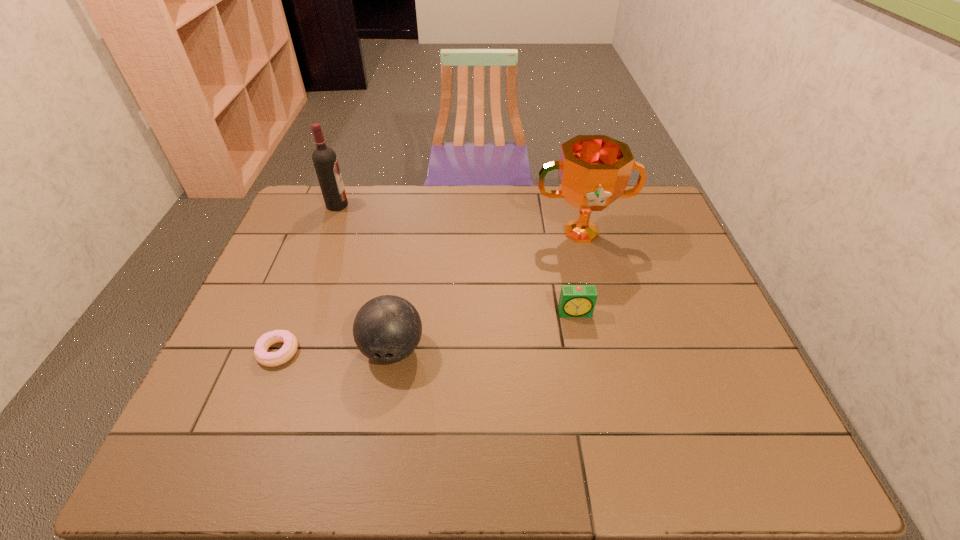
The height and width of the screenshot is (540, 960). Identify the location of vacant space at the near edge of the desktop. (658, 455).

Image resolution: width=960 pixels, height=540 pixels. In the image, there is a desktop. Find the location of `vacant space at the left edge`. vacant space at the left edge is located at coordinates (274, 391).

This screenshot has width=960, height=540. In the image, there is a desktop. Find the location of `vacant area at the right edge`. vacant area at the right edge is located at coordinates (670, 326).

Locate an element on the screen. vacant space at the far right corner is located at coordinates (618, 204).

Image resolution: width=960 pixels, height=540 pixels. Identify the location of free space between the farthest object and the shortest object. (307, 279).

Image resolution: width=960 pixels, height=540 pixels. I want to click on free point between the fourth nearest object and the third object from left to right, so click(x=487, y=291).

Locate an element on the screen. The height and width of the screenshot is (540, 960). vacant area between the second farthest object and the shortest object is located at coordinates (430, 292).

Identify the location of vacant region between the award and the doughnut. (430, 292).

Where is `vacant space that is in between the doughnut and the alarm clock`? This screenshot has height=540, width=960. vacant space that is in between the doughnut and the alarm clock is located at coordinates (427, 332).

Where is `free spot between the third nearest object and the award`? The height and width of the screenshot is (540, 960). free spot between the third nearest object and the award is located at coordinates (578, 273).